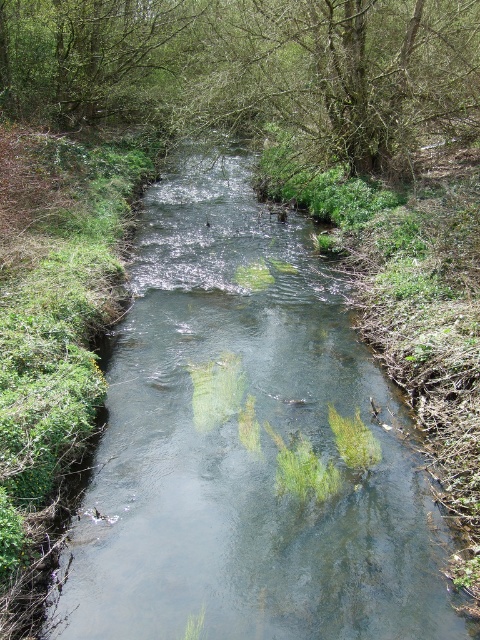
You are standing at the edge of the stream and want to reach a specific point marked as point (261,387). Given that the stream is 6 meters wide, can you safely cross the stream at this point?

The point (261,387) is 6.74 meters from the camera, which is beyond the stream width of 6 meters. Therefore, you cannot safely cross the stream at this point as it lies outside the stream boundaries.

You are standing at the edge of the stream and see the green leafy tree at center and the green leafy tree at upper left. Which tree is closer to the water surface?

The green leafy tree at center is located below the green leafy tree at upper left, meaning it is closer to the water surface.

You are a hiker who wants to cross the stream safely. The clear water stream at center is below the green leafy tree at center. Which direction should you walk to avoid the tree and reach the stream?

To avoid the green leafy tree at center and reach the clear water stream at center, you should walk towards the stream in a direction away from the tree. Since the stream is below the tree, moving downward or away from the tree towards the stream would be the safest path.